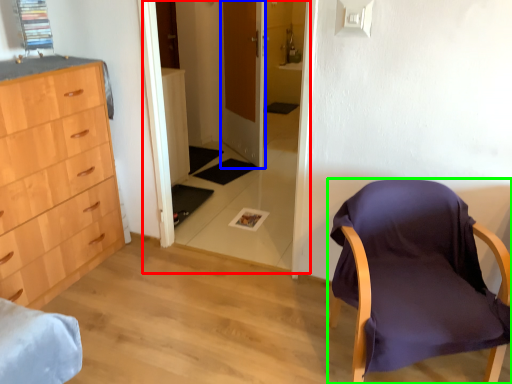
Question: Considering the real-world distances, which object is closest to glass door (highlighted by a red box)? door (highlighted by a blue box) or chair (highlighted by a green box).

Choices:
 (A) door
 (B) chair

Answer: (A)